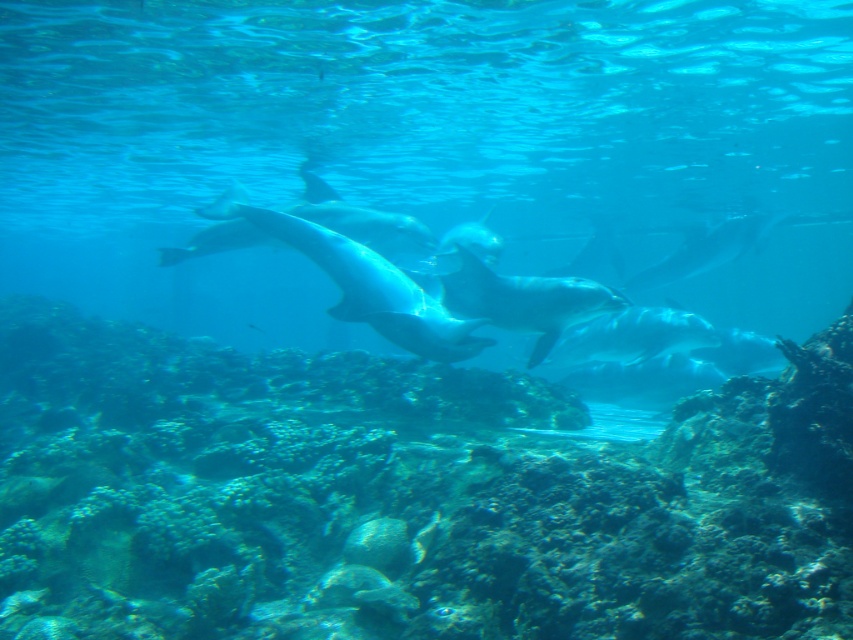
You are a marine biologist observing the underwater scene. You notice two dolphins swimming closely together. Which dolphin is positioned to the left of the other? The dolphins in question are the glossy blue dolphin at center and the glossy white dolphin at center.

The glossy blue dolphin at center is positioned to the left of the glossy white dolphin at center.

You are a marine biologist observing the underwater scene. There is a point marked at coordinates (403, 497). Which object in the scene is this point located on?

The point at coordinates (403, 497) is located on the green coral reef at center.